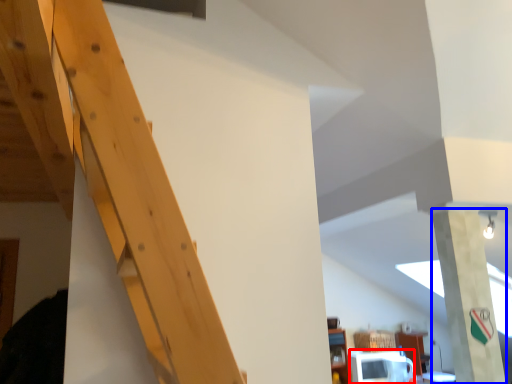
Question: Which point is further to the camera, microwave (highlighted by a red box) or pillar (highlighted by a blue box)?

Choices:
 (A) microwave
 (B) pillar

Answer: (A)